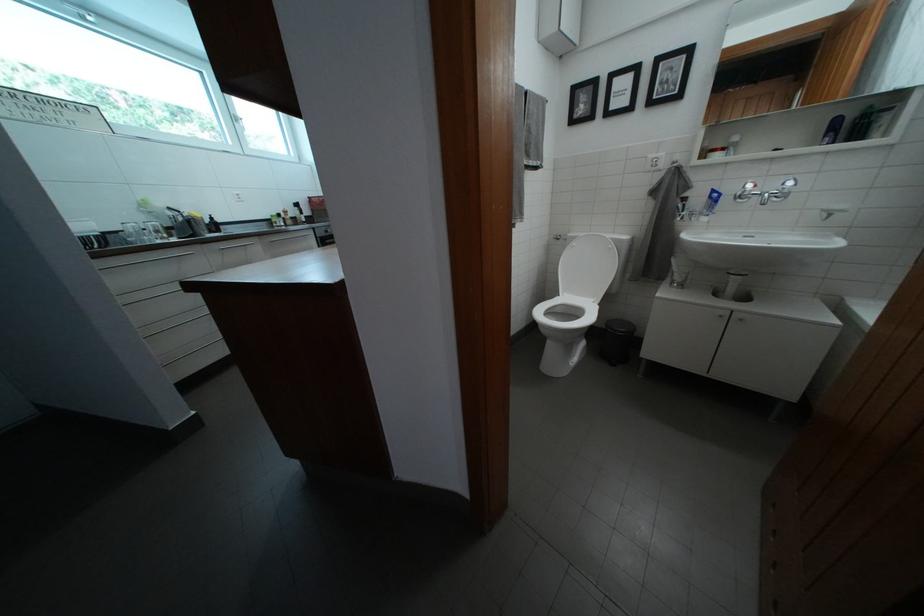
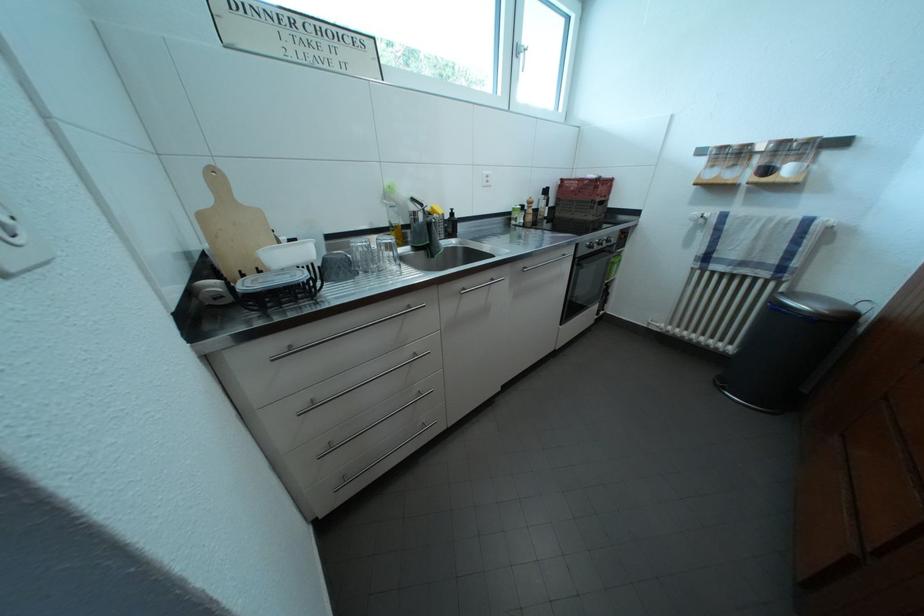
The point at (244, 124) is marked in the first image. Where is the corresponding point in the second image?

(525, 55)